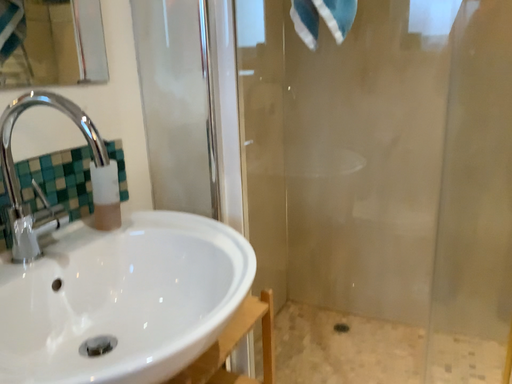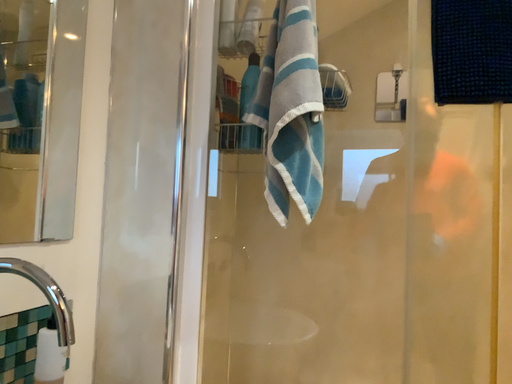
Question: How did the camera likely rotate when shooting the video?

Choices:
 (A) rotated downward
 (B) rotated upward

Answer: (B)